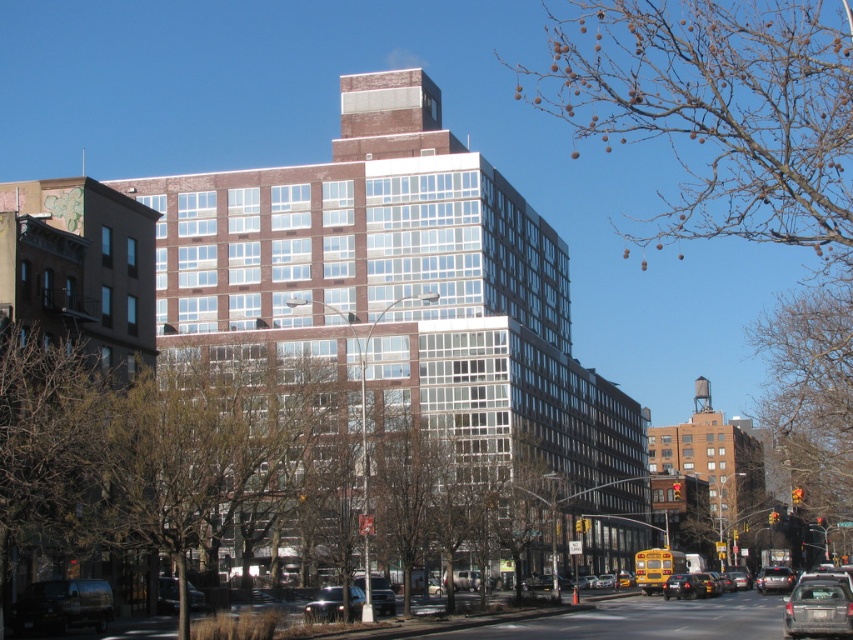
Is rusty metallic suv at lower right further to the viewer compared to metallic silver car at center?

That is False.

Measure the distance between rusty metallic suv at lower right and camera.

They are 177.25 feet apart.

Does point (828, 598) lie in front of point (764, 582)?

Yes, it is in front of point (764, 582).

Find the location of a particular element. This screenshot has height=640, width=853. rusty metallic suv at lower right is located at coordinates (817, 608).

Is dark gray matte van at lower left positioned at the back of matte black car at center?

No, dark gray matte van at lower left is in front of matte black car at center.

Who is taller, dark gray matte van at lower left or matte black car at center?

matte black car at center is taller.

Between point (105, 589) and point (685, 579), which one is positioned behind?

The point (685, 579) is behind.

At what (x,y) coordinates should I click in order to perform the action: click on dark gray matte van at lower left. Please return your answer as a coordinate pair (x, y). This screenshot has height=640, width=853. Looking at the image, I should click on (62, 605).

Between yellow matte taxi at center and metallic silver car at center, which one has less height?

Standing shorter between the two is yellow matte taxi at center.

Is point (653, 556) positioned behind point (759, 588)?

Yes.

The image size is (853, 640). What do you see at coordinates (656, 566) in the screenshot? I see `yellow matte taxi at center` at bounding box center [656, 566].

Locate an element on the screen. yellow matte taxi at center is located at coordinates (x=656, y=566).